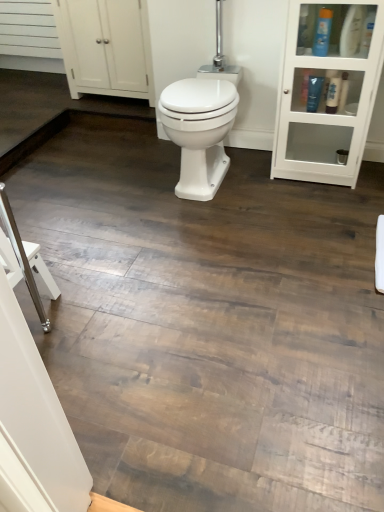
At what (x,y) coordinates should I click in order to perform the action: click on vacant space that is to the left of white matte cabinet at upper left. Please return your answer as a coordinate pair (x, y). Looking at the image, I should click on (48, 111).